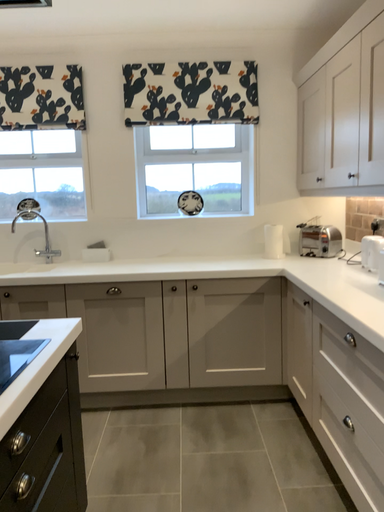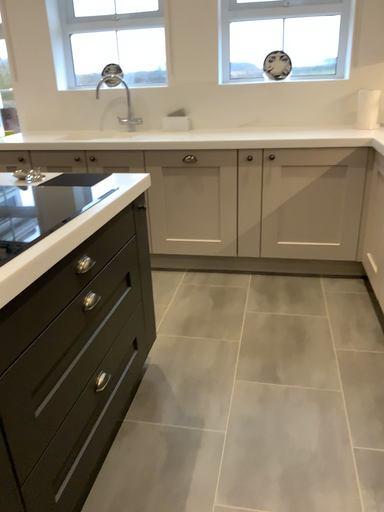
Question: Which way did the camera rotate in the video?

Choices:
 (A) rotated left
 (B) rotated right

Answer: (A)